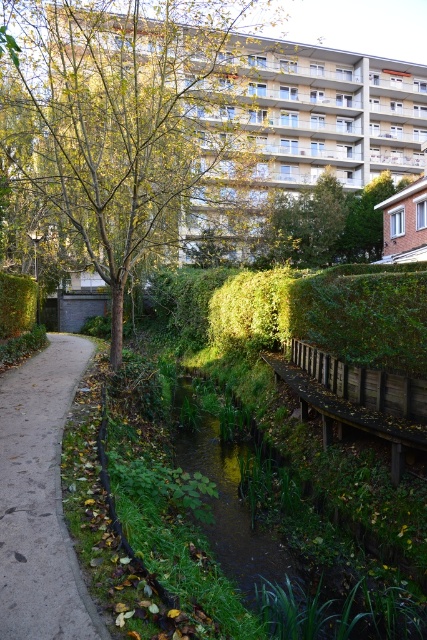
In the scene shown: Is green leafy tree at center below green leafy tree at upper center?

Incorrect, green leafy tree at center is not positioned below green leafy tree at upper center.

Who is more distant from viewer, (211, 189) or (306, 243)?

Point (211, 189)

At what (x,y) coordinates should I click in order to perform the action: click on green leafy tree at center. Please return your answer as a coordinate pair (x, y). The height and width of the screenshot is (640, 427). Looking at the image, I should click on (128, 120).

At what (x,y) coordinates should I click in order to perform the action: click on green leafy tree at center. Please return your answer as a coordinate pair (x, y). This screenshot has width=427, height=640. Looking at the image, I should click on (128, 120).

Between point (101, 182) and point (263, 476), which one is positioned behind?

The point (101, 182) is more distant.

Who is more distant from viewer, (14, 120) or (227, 522)?

Positioned behind is point (14, 120).

At what (x,y) coordinates should I click in order to perform the action: click on green leafy tree at center. Please return your answer as a coordinate pair (x, y). Looking at the image, I should click on (128, 120).

Can you confirm if concrete pavement at left is bigger than green leafy tree at upper center?

Result: No.

Does concrete pavement at left come in front of green leafy tree at upper center?

That is True.

Describe the element at coordinates (40, 500) in the screenshot. I see `concrete pavement at left` at that location.

Find the location of a particular element. Image resolution: width=427 pixels, height=640 pixels. concrete pavement at left is located at coordinates (40, 500).